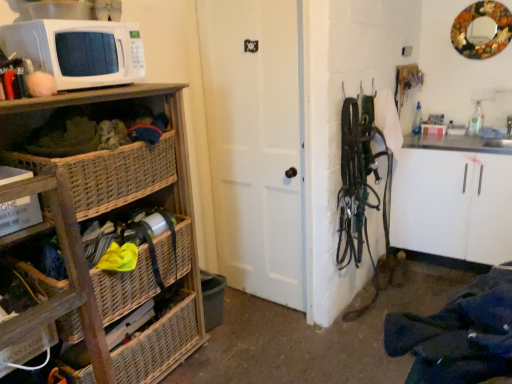
Question: Considering the positions of woven wood shelf at left and white matte microwave at upper left in the image, is woven wood shelf at left wider or thinner than white matte microwave at upper left?

Choices:
 (A) thin
 (B) wide

Answer: (B)

Question: From a real-world perspective, is woven wood shelf at left above or below white matte microwave at upper left?

Choices:
 (A) below
 (B) above

Answer: (A)

Question: Which of these objects is positioned farthest from the woven wood shelf at left?

Choices:
 (A) dark blue fabric at lower right
 (B) woven wicker basket at lower left, which is counted as the second basket, starting from the bottom
 (C) woven wood basket at left
 (D) woven wood basket at lower left, which is counted as the second basket, starting from the top
 (E) white matte door at center

Answer: (A)

Question: Considering the real-world distances, which object is closest to the white matte microwave at upper left?

Choices:
 (A) woven wicker basket at lower left, which ranks as the first basket in top-to-bottom order
 (B) woven wood shelf at left
 (C) woven wood basket at left
 (D) woven wood basket at lower left, which is counted as the second basket, starting from the top
 (E) dark blue fabric at lower right

Answer: (C)